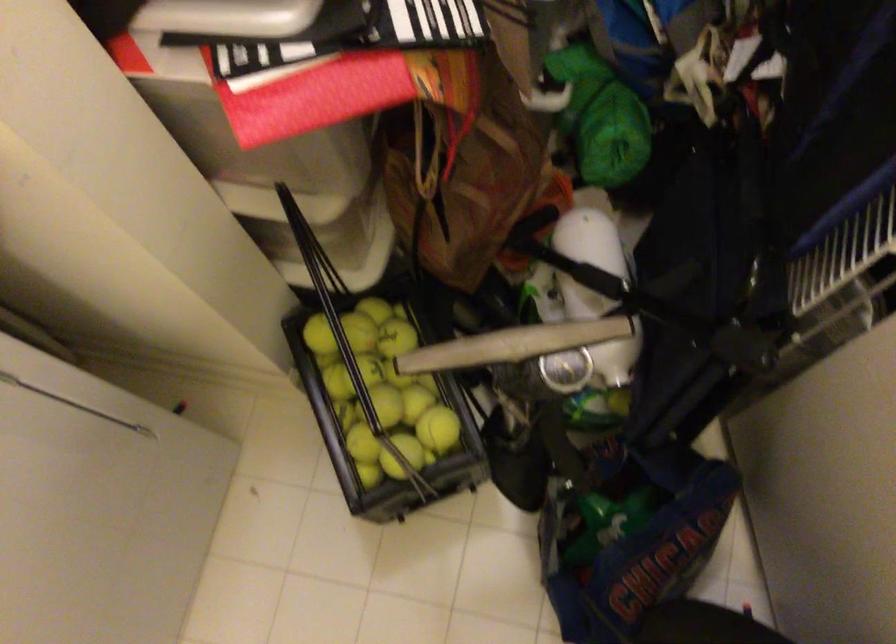
Where is `black handle`? The width and height of the screenshot is (896, 644). black handle is located at coordinates (657, 327).